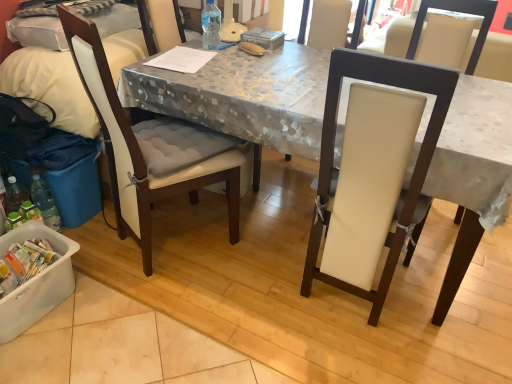
What are the coordinates of `vacant space to the right of white leather chair at center, which appears as the second chair when viewed from the left` in the screenshot? It's located at (453, 297).